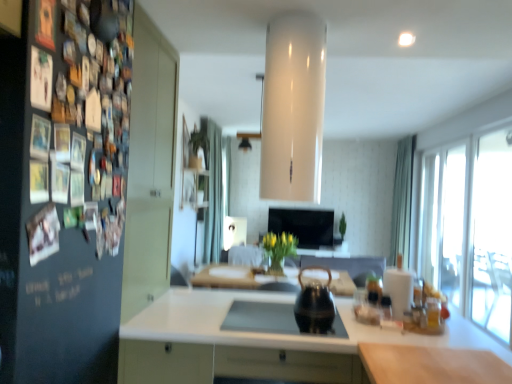
Question: Considering the relative sizes of dark matte board at left and white glossy countertop at center, which is counted as the first countertop, starting from the back, in the image provided, is dark matte board at left taller than white glossy countertop at center, which is counted as the first countertop, starting from the back,?

Choices:
 (A) yes
 (B) no

Answer: (A)

Question: Is dark matte board at left at the left side of white glossy countertop at center, the second countertop positioned from the right?

Choices:
 (A) no
 (B) yes

Answer: (B)

Question: Is dark matte board at left oriented away from white glossy countertop at center, which is counted as the first countertop, starting from the back?

Choices:
 (A) no
 (B) yes

Answer: (A)

Question: Is dark matte board at left smaller than white glossy countertop at center, the 2th countertop in the top-to-bottom sequence?

Choices:
 (A) no
 (B) yes

Answer: (A)

Question: Is the position of dark matte board at left more distant than that of white glossy countertop at center, positioned as the second countertop in front-to-back order?

Choices:
 (A) yes
 (B) no

Answer: (B)

Question: Visually, is black glossy tv at center positioned to the left or to the right of dark matte board at left?

Choices:
 (A) right
 (B) left

Answer: (A)

Question: Looking at the image, does black glossy tv at center seem bigger or smaller compared to dark matte board at left?

Choices:
 (A) big
 (B) small

Answer: (B)

Question: Is black glossy tv at center inside or outside of dark matte board at left?

Choices:
 (A) inside
 (B) outside

Answer: (B)

Question: In terms of width, does black glossy tv at center look wider or thinner when compared to dark matte board at left?

Choices:
 (A) wide
 (B) thin

Answer: (B)

Question: Is point (439, 258) closer or farther from the camera than point (340, 332)?

Choices:
 (A) closer
 (B) farther

Answer: (B)

Question: From a real-world perspective, is transparent glass door at right, marked as the 1th glass door in a back-to-front arrangement, physically located above or below black glass sink at center?

Choices:
 (A) above
 (B) below

Answer: (A)

Question: Considering their positions, is transparent glass door at right, marked as the 1th glass door in a back-to-front arrangement, located in front of or behind black glass sink at center?

Choices:
 (A) behind
 (B) front

Answer: (A)

Question: Would you say transparent glass door at right, marked as the 1th glass door in a back-to-front arrangement, is to the left or to the right of black glass sink at center in the picture?

Choices:
 (A) right
 (B) left

Answer: (A)

Question: From their relative heights in the image, would you say transparent glass door at right, the second glass door from the back, is taller or shorter than green fabric curtain at right, the first curtain in the right-to-left sequence?

Choices:
 (A) tall
 (B) short

Answer: (B)

Question: Is transparent glass door at right, the second glass door from the back, spatially inside green fabric curtain at right, acting as the second curtain starting from the left, or outside of it?

Choices:
 (A) outside
 (B) inside

Answer: (A)